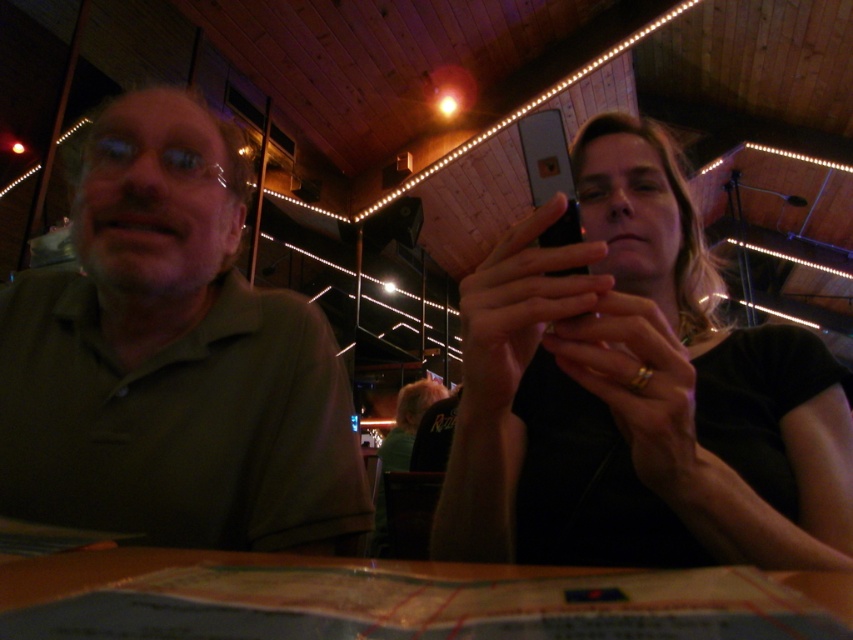
Question: Which point is closer to the camera?

Choices:
 (A) (795, 328)
 (B) (154, 186)

Answer: (B)

Question: Which point is farther to the camera?

Choices:
 (A) green matte shirt at left
 (B) wooden table at center

Answer: (A)

Question: Is black matte phone at upper right above wooden table at center?

Choices:
 (A) yes
 (B) no

Answer: (A)

Question: Is green matte shirt at left further to camera compared to wooden table at center?

Choices:
 (A) yes
 (B) no

Answer: (A)

Question: Can you confirm if black matte phone at upper right is positioned below wooden table at center?

Choices:
 (A) no
 (B) yes

Answer: (A)

Question: Which object is positioned closest to the wooden table at center?

Choices:
 (A) black matte phone at upper right
 (B) green matte shirt at left

Answer: (A)